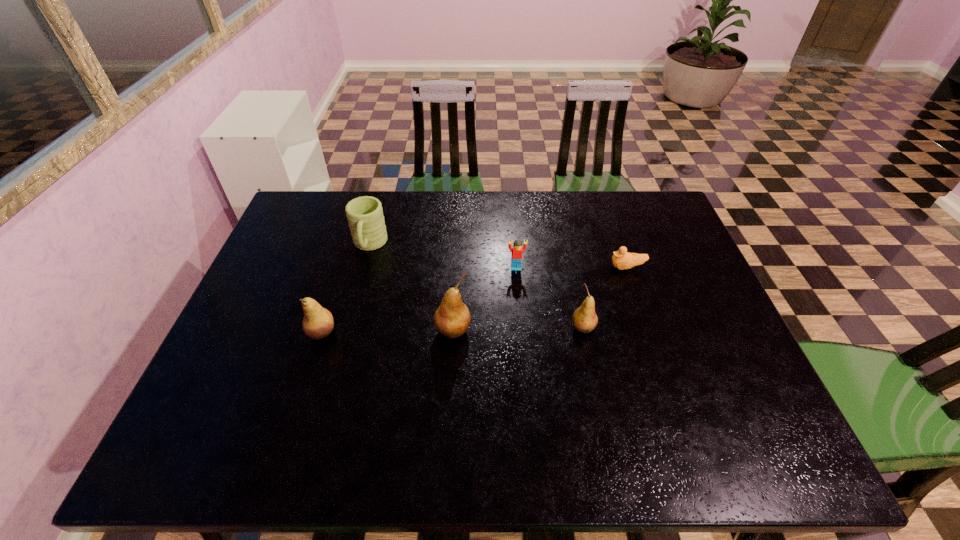
Please point a vacant point for placing a pear on the right. Please provide its 2D coordinates. Your answer should be formatted as a tuple, i.e. [(x, y)], where the tuple contains the x and y coordinates of a point satisfying the conditions above.

[(711, 326)]